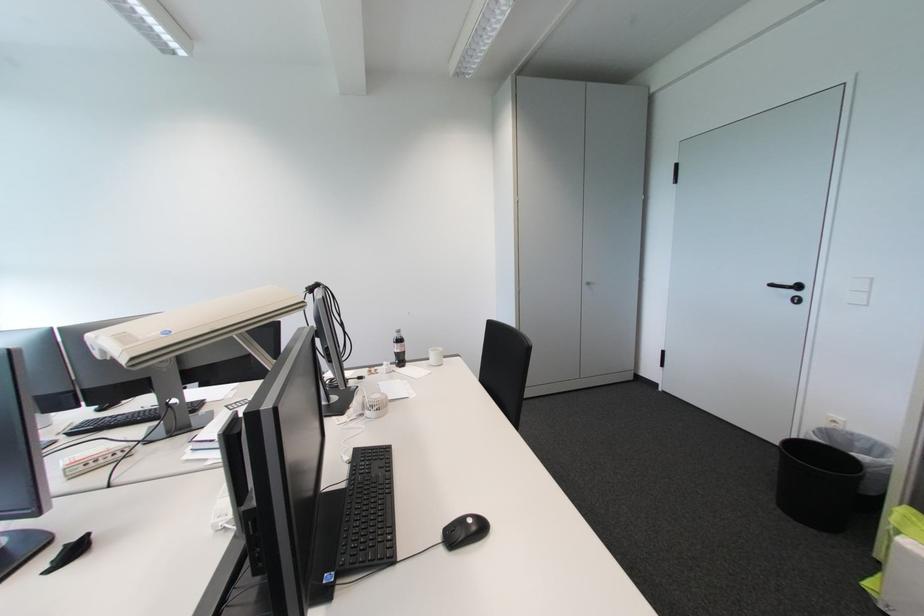
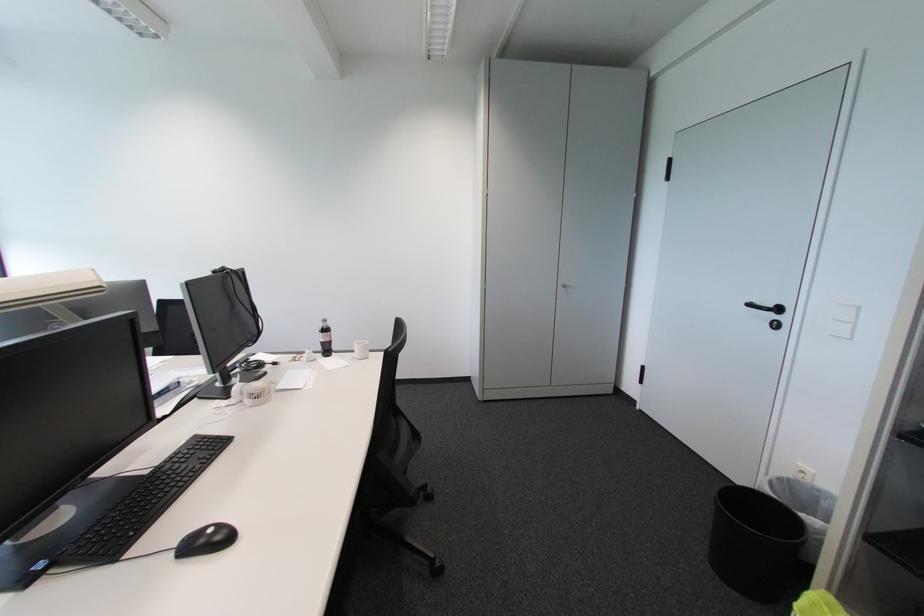
Where in the second image is the point corresponding to (786,513) from the first image?

(714, 565)